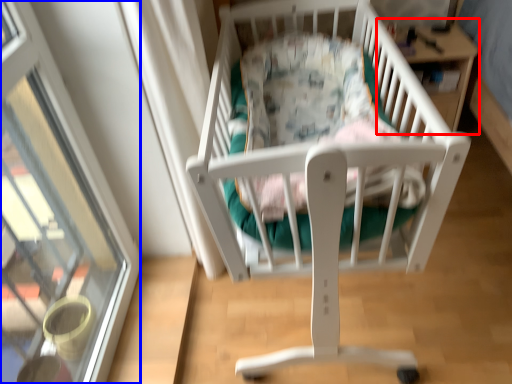
Question: Among these objects, which one is farthest to the camera, table (highlighted by a red box) or glass door (highlighted by a blue box)?

Choices:
 (A) table
 (B) glass door

Answer: (A)